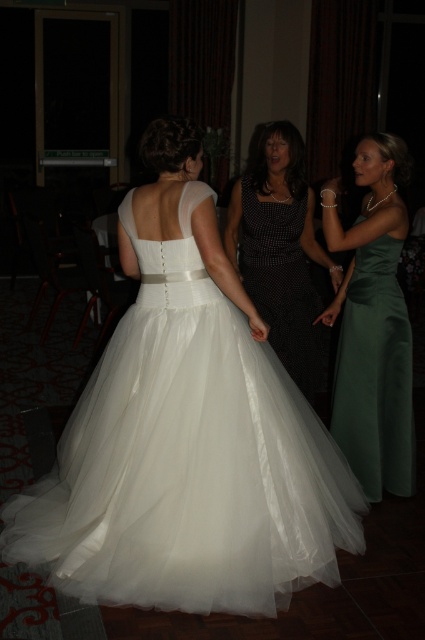
The image size is (425, 640). Identify the location of white tulle dress at center. (187, 458).

Which is above, white tulle dress at center or satin green dress at right?

satin green dress at right is higher up.

Identify the location of white tulle dress at center. (187, 458).

Where is `white tulle dress at center`? Image resolution: width=425 pixels, height=640 pixels. white tulle dress at center is located at coordinates (187, 458).

Is satin green dress at right above black dotted dress at center?

Actually, satin green dress at right is below black dotted dress at center.

Is satin green dress at right bigger than black dotted dress at center?

Indeed, satin green dress at right has a larger size compared to black dotted dress at center.

Measure the distance between point (377, 214) and camera.

They are 2.56 meters apart.

Find the location of a particular element. The width and height of the screenshot is (425, 640). satin green dress at right is located at coordinates (373, 324).

Between white tulle dress at center and black dotted dress at center, which one appears on the left side from the viewer's perspective?

From the viewer's perspective, white tulle dress at center appears more on the left side.

The image size is (425, 640). Identify the location of white tulle dress at center. (187, 458).